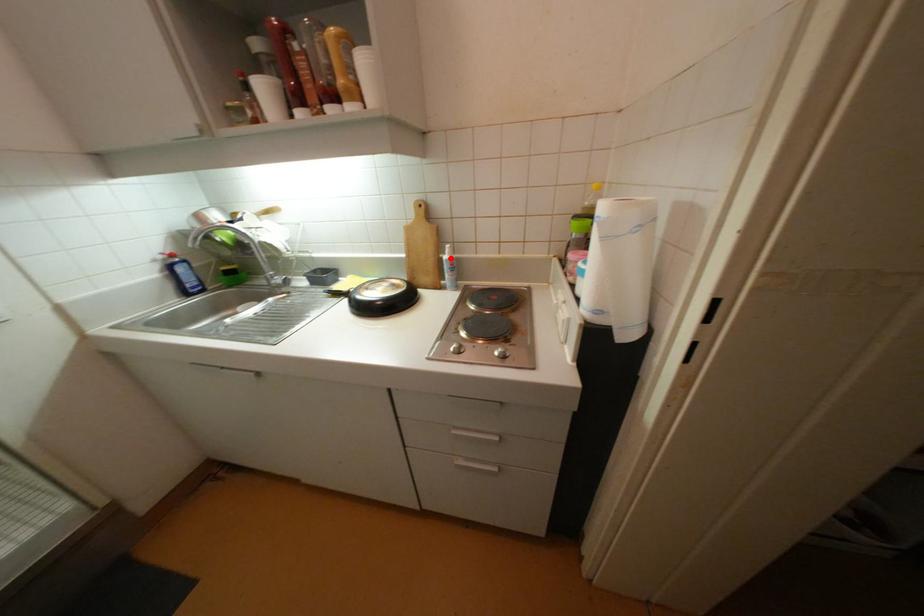
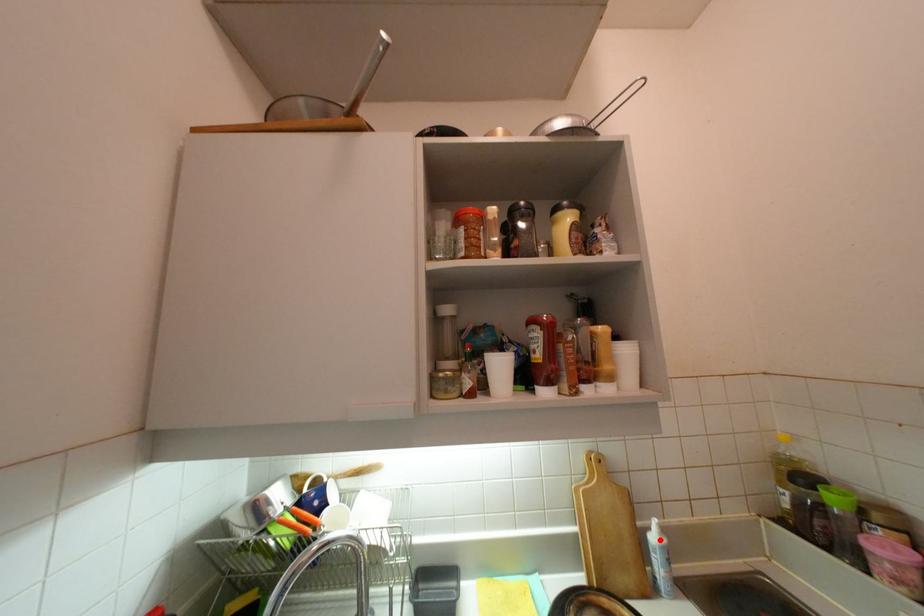
I am providing you with two images of the same scene from different viewpoints. A red point is marked on the first image and another point is marked on the second image. Do the highlighted points in image1 and image2 indicate the same real-world spot?

Yes